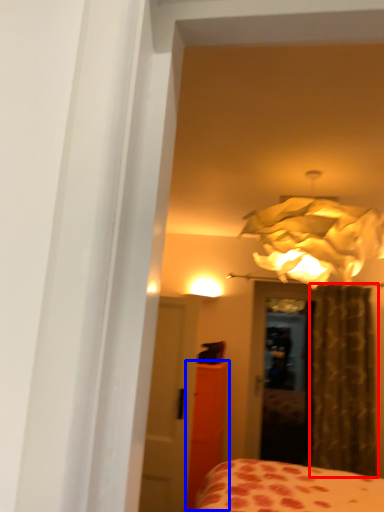
Question: Which object appears closest to the camera in this image, curtain (highlighted by a red box) or armoire (highlighted by a blue box)?

Choices:
 (A) curtain
 (B) armoire

Answer: (B)